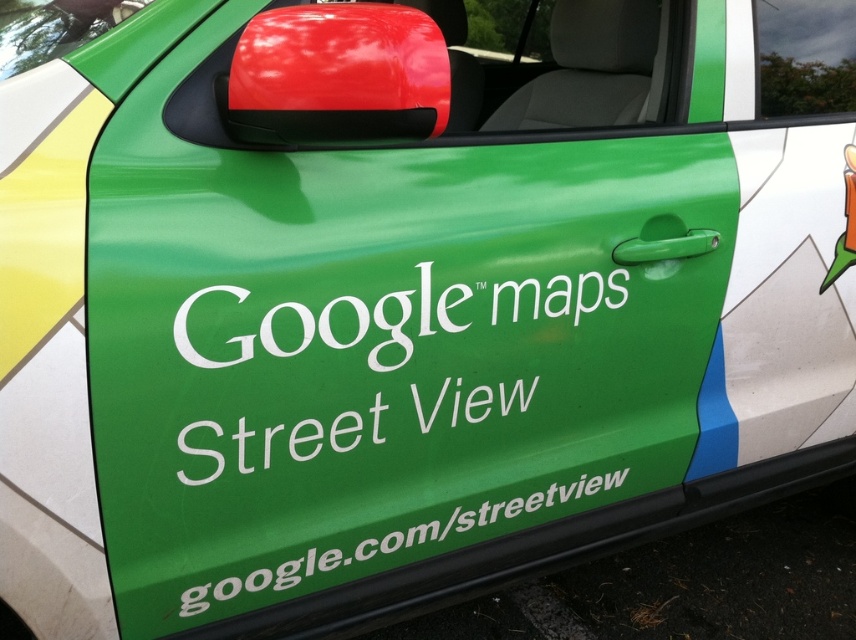
Is green matte text at center taller than white text on green at lower center?

Yes, green matte text at center is taller than white text on green at lower center.

In order to click on green matte text at center in this screenshot , I will do `click(328, 324)`.